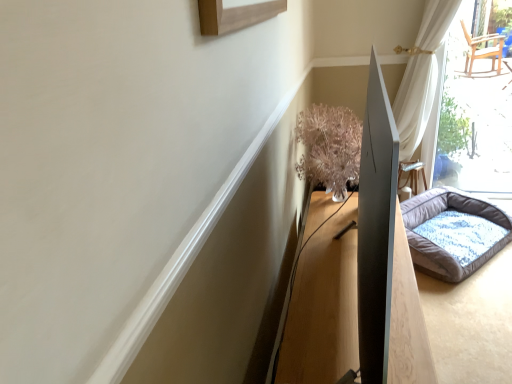
Question: Considering the relative sizes of fluffy gray dog bed at right and translucent glass vase at upper right in the image provided, is fluffy gray dog bed at right bigger than translucent glass vase at upper right?

Choices:
 (A) yes
 (B) no

Answer: (A)

Question: Is there a large distance between fluffy gray dog bed at right and translucent glass vase at upper right?

Choices:
 (A) no
 (B) yes

Answer: (A)

Question: From the image's perspective, is fluffy gray dog bed at right beneath translucent glass vase at upper right?

Choices:
 (A) yes
 (B) no

Answer: (A)

Question: Is fluffy gray dog bed at right taller than translucent glass vase at upper right?

Choices:
 (A) yes
 (B) no

Answer: (B)

Question: Considering the relative sizes of fluffy gray dog bed at right and translucent glass vase at upper right in the image provided, is fluffy gray dog bed at right shorter than translucent glass vase at upper right?

Choices:
 (A) yes
 (B) no

Answer: (A)

Question: From a real-world perspective, is translucent glass vase at upper right above or below fluffy gray dog bed at right?

Choices:
 (A) above
 (B) below

Answer: (A)

Question: In terms of width, does translucent glass vase at upper right look wider or thinner when compared to fluffy gray dog bed at right?

Choices:
 (A) wide
 (B) thin

Answer: (B)

Question: Is translucent glass vase at upper right spatially inside fluffy gray dog bed at right, or outside of it?

Choices:
 (A) inside
 (B) outside

Answer: (B)

Question: From the image's perspective, is translucent glass vase at upper right above or below fluffy gray dog bed at right?

Choices:
 (A) below
 (B) above

Answer: (B)

Question: Is wooden table at center taller or shorter than translucent glass vase at upper right?

Choices:
 (A) short
 (B) tall

Answer: (A)

Question: From the image's perspective, is wooden table at center located above or below translucent glass vase at upper right?

Choices:
 (A) above
 (B) below

Answer: (B)

Question: Visually, is wooden table at center positioned to the left or to the right of translucent glass vase at upper right?

Choices:
 (A) left
 (B) right

Answer: (B)

Question: Is wooden table at center bigger or smaller than translucent glass vase at upper right?

Choices:
 (A) small
 (B) big

Answer: (B)

Question: Is translucent glass vase at upper right inside or outside of wooden table at center?

Choices:
 (A) outside
 (B) inside

Answer: (A)

Question: Looking at their shapes, would you say translucent glass vase at upper right is wider or thinner than wooden table at center?

Choices:
 (A) wide
 (B) thin

Answer: (B)